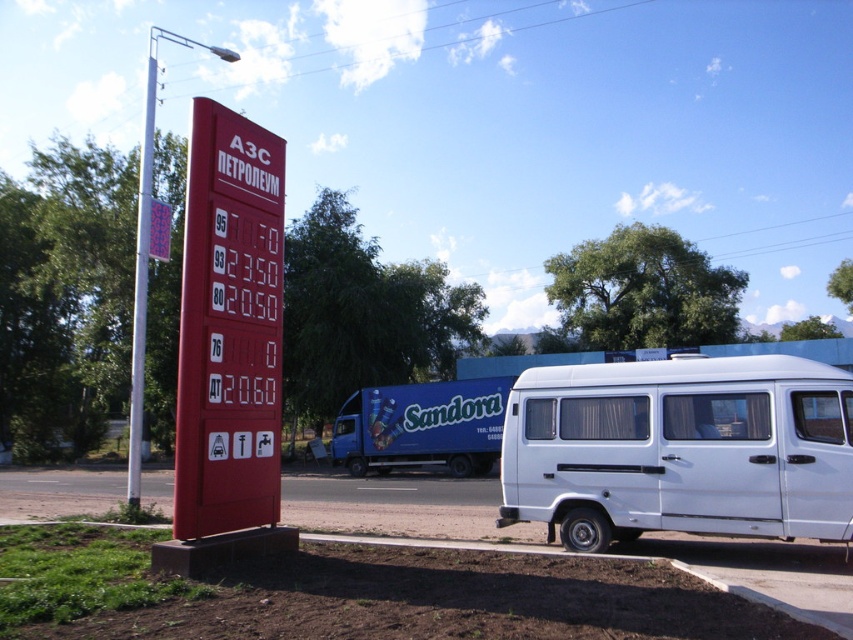
You are a delivery driver who needs to park your truck near the white matte van at right. The parking space is marked by the white plastic pole at upper left. Can you safely park your truck without blocking the pole?

The white matte van at right is positioned under the white plastic pole at upper left, so parking there might block the pole. Choose another spot.

Looking at this image, you are a driver who just arrived at the gas station. You need to park your car in a spot that is to the left of the white plastic pole at upper left. Is the white matte van at right currently blocking that parking spot?

The white matte van at right is to the right of the white plastic pole at upper left, so it is not blocking the parking spot to the left of the white plastic pole at upper left. You can park there without any obstruction.